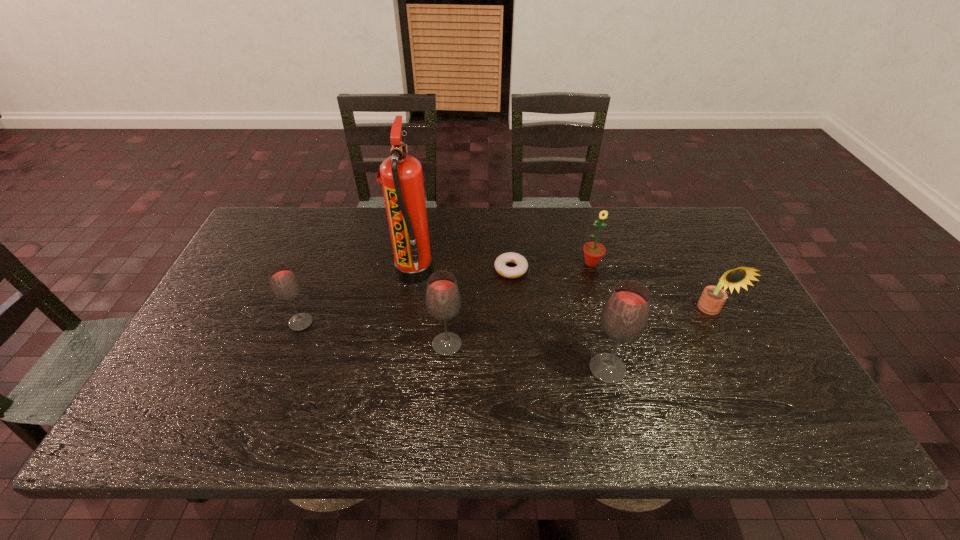
Identify the location of the leftmost object. tap(284, 283).

This screenshot has width=960, height=540. Find the location of `the shortest glass drink container`. the shortest glass drink container is located at coordinates (284, 283).

Locate an element on the screen. This screenshot has height=540, width=960. the second shortest glass drink container is located at coordinates (443, 300).

This screenshot has height=540, width=960. Find the location of `the third object from left to right`. the third object from left to right is located at coordinates click(443, 300).

Locate an element on the screen. the rightmost glass drink container is located at coordinates (625, 315).

You are a GUI agent. You are given a task and a screenshot of the screen. Output one action in this format:
    pyautogui.click(x=<x>, y=<y>)
    Task: Click on the fourth object from left to right
    This screenshot has height=540, width=960.
    Given the screenshot: What is the action you would take?
    pyautogui.click(x=500, y=263)

Identify the location of doughnut. The height and width of the screenshot is (540, 960). (500, 263).

At what (x,y) coordinates should I click in order to perform the action: click on the right sunflower. Please return your answer as a coordinate pair (x, y). Looking at the image, I should click on click(x=712, y=299).

Locate an element on the screen. the rightmost object is located at coordinates (712, 299).

Find the location of a particular element. The height and width of the screenshot is (540, 960). the second object from left to right is located at coordinates [401, 175].